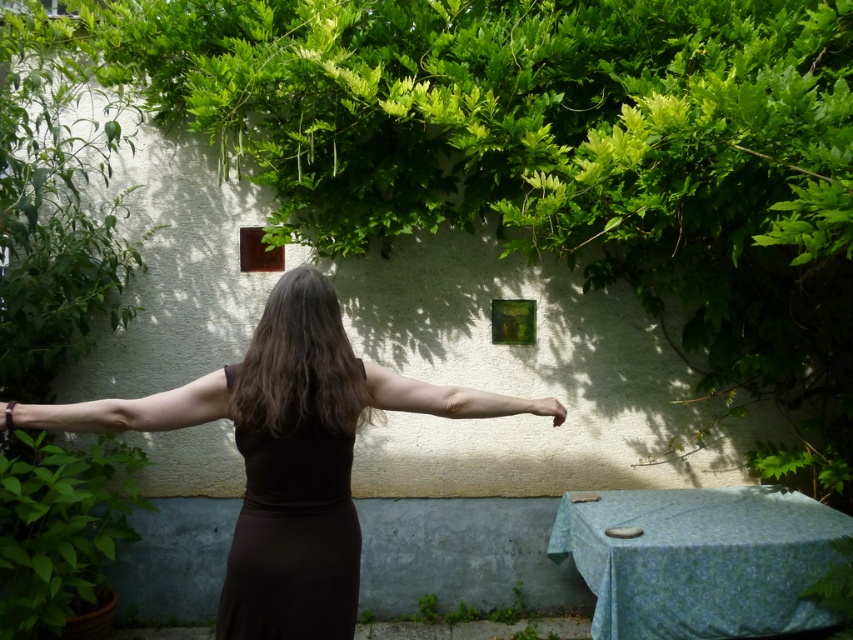
Can you confirm if brown matte dress at center is shorter than matte skin arm at center?

Incorrect, brown matte dress at center's height does not fall short of matte skin arm at center's.

The image size is (853, 640). Describe the element at coordinates (288, 456) in the screenshot. I see `brown matte dress at center` at that location.

Who is more distant from viewer, [323,316] or [384,387]?

Positioned behind is point [384,387].

The width and height of the screenshot is (853, 640). Identify the location of brown matte dress at center. (288, 456).

Who is shorter, smooth skin arm at center or matte black hand at center?

matte black hand at center

The height and width of the screenshot is (640, 853). Describe the element at coordinates (128, 410) in the screenshot. I see `smooth skin arm at center` at that location.

Is point (207, 413) positioned after point (564, 417)?

That is False.

The width and height of the screenshot is (853, 640). Find the location of `smooth skin arm at center`. smooth skin arm at center is located at coordinates (128, 410).

Does brown matte dress at center come in front of brown smooth hair at center?

Yes, brown matte dress at center is in front of brown smooth hair at center.

Which is more to the right, brown matte dress at center or brown smooth hair at center?

Positioned to the right is brown matte dress at center.

Which is behind, point (334, 444) or point (337, 352)?

The point (337, 352) is more distant.

Locate an element on the screen. The height and width of the screenshot is (640, 853). brown matte dress at center is located at coordinates (288, 456).